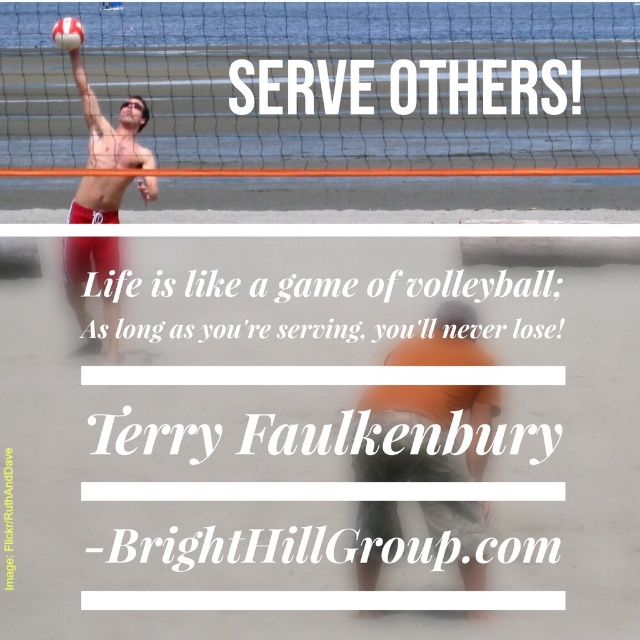
Is matte skin at center positioned before white matte volleyball at center?

Yes, it is in front of white matte volleyball at center.

Between matte skin at center and white matte volleyball at center, which one is positioned lower?

matte skin at center

This screenshot has width=640, height=640. What do you see at coordinates (422, 429) in the screenshot?
I see `matte skin at center` at bounding box center [422, 429].

The width and height of the screenshot is (640, 640). I want to click on matte skin at center, so click(x=422, y=429).

Does point (134, 154) lie in front of point (68, 22)?

Yes, it is.

Is matte red shorts at left wider than white matte volleyball at center?

Indeed, matte red shorts at left has a greater width compared to white matte volleyball at center.

Does point (132, 168) lie behind point (77, 26)?

Yes.

You are a GUI agent. You are given a task and a screenshot of the screen. Output one action in this format:
    pyautogui.click(x=<x>, y=<y>)
    Task: Click on the matte red shorts at left
    
    Given the screenshot: What is the action you would take?
    pyautogui.click(x=97, y=284)

Does matte skin at center have a smaller size compared to matte red shorts at left?

Correct, matte skin at center occupies less space than matte red shorts at left.

Which is more to the right, matte skin at center or matte red shorts at left?

From the viewer's perspective, matte skin at center appears more on the right side.

Between point (454, 362) and point (76, 68), which one is positioned in front?

Point (454, 362) is in front.

Where is `matte skin at center`? matte skin at center is located at coordinates (422, 429).